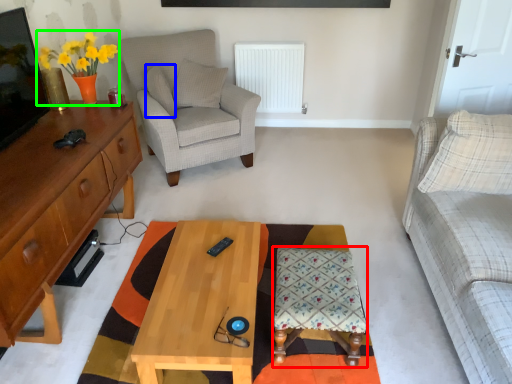
Question: Which object is positioned closest to stool (highlighted by a red box)? Select from pillow (highlighted by a blue box) and houseplant (highlighted by a green box).

Choices:
 (A) pillow
 (B) houseplant

Answer: (B)